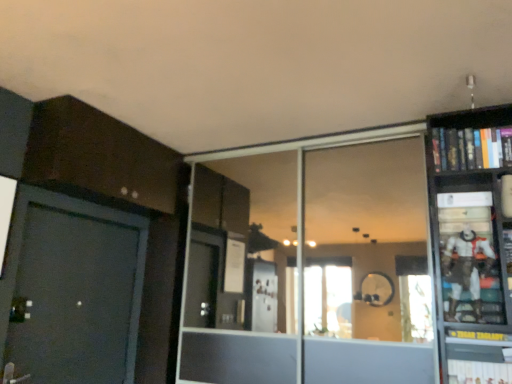
Question: From their relative heights in the image, would you say white matte action figure at right is taller or shorter than hardcover book at upper right, which is the 1th book in top-to-bottom order?

Choices:
 (A) short
 (B) tall

Answer: (B)

Question: From a real-world perspective, is white matte action figure at right above or below hardcover book at upper right, which is the 1th book in top-to-bottom order?

Choices:
 (A) below
 (B) above

Answer: (A)

Question: Which object is the closest to the hardcover book at upper right, which is the 1th book in top-to-bottom order?

Choices:
 (A) transparent glass door at center
 (B) hardcover book at lower right, the 2th book when ordered from top to bottom
 (C) white matte action figure at right

Answer: (C)

Question: Which of these objects is positioned closest to the transparent glass door at center?

Choices:
 (A) white matte action figure at right
 (B) hardcover book at lower right, the 2th book when ordered from top to bottom
 (C) hardcover book at upper right, which is the 1th book in top-to-bottom order

Answer: (C)